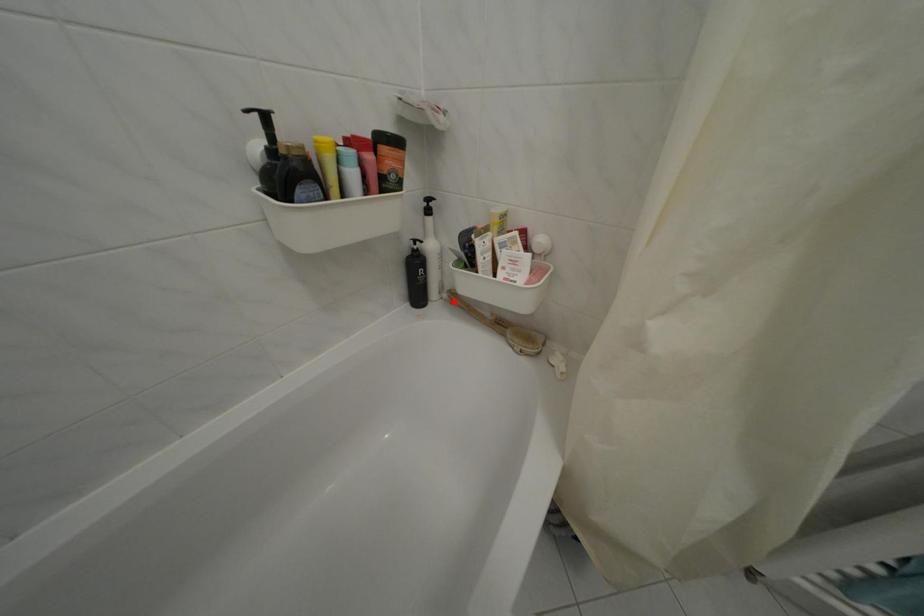
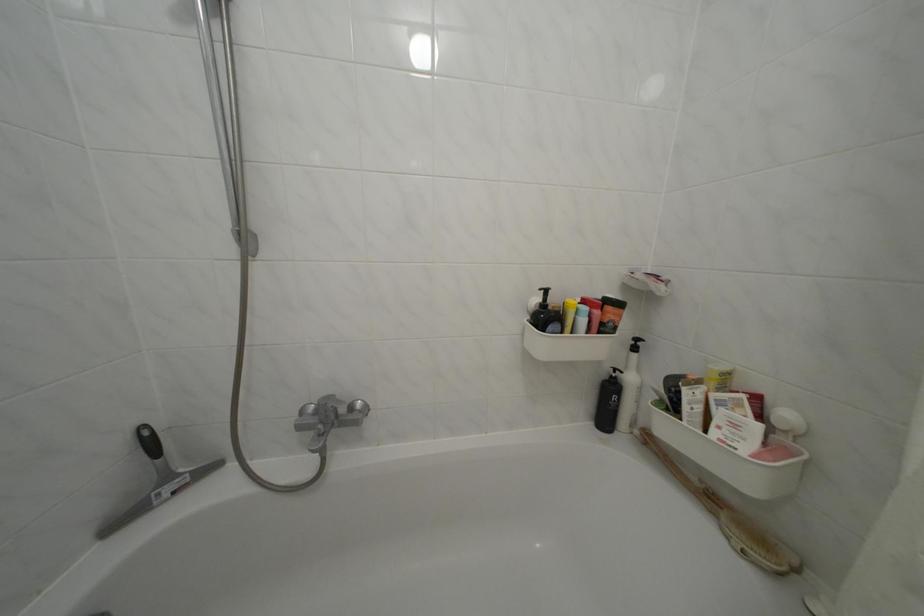
Find the pixel in the second image that matches the highlighted location in the first image.

(646, 438)